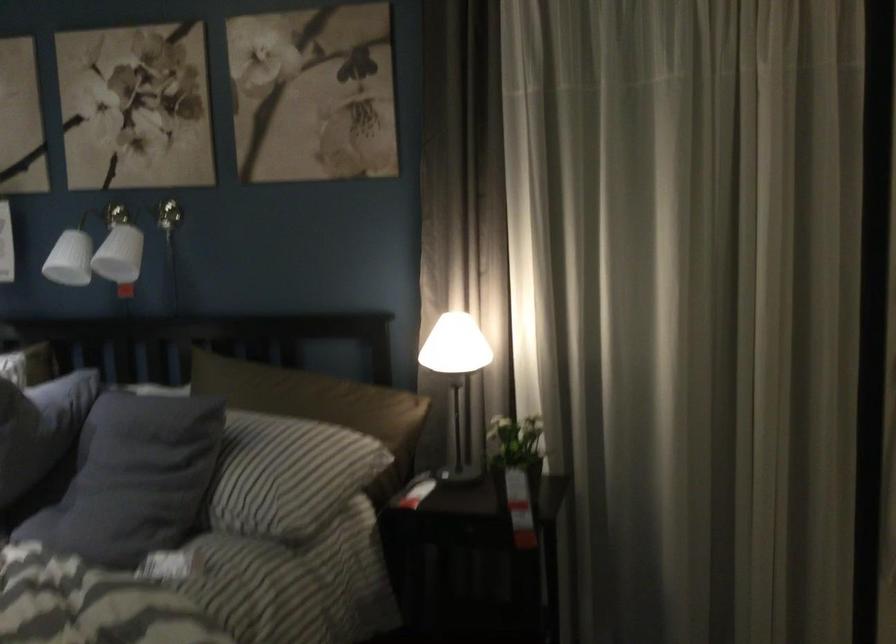
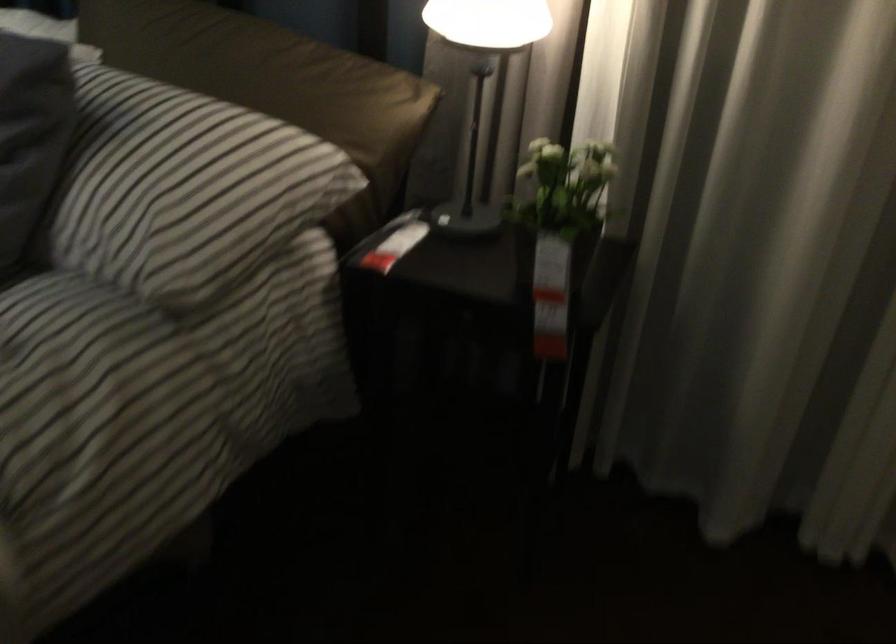
Question: The first image is from the beginning of the video and the second image is from the end. How did the camera likely rotate when shooting the video?

Choices:
 (A) Left
 (B) Right
 (C) Up
 (D) Down

Answer: (D)